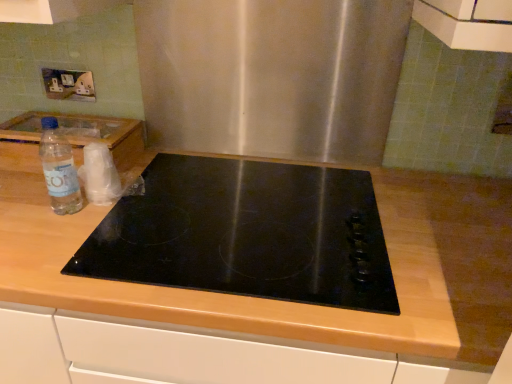
In order to click on black glass cooktop at center in this screenshot , I will do [x=247, y=233].

Locate an element on the screen. white plastic electric outlet at upper left is located at coordinates (68, 84).

Looking at this image, what is the approximate width of white plastic electric outlet at upper left?

It is 0.85 inches.

This screenshot has width=512, height=384. What do you see at coordinates (298, 303) in the screenshot?
I see `wooden at center` at bounding box center [298, 303].

What do you see at coordinates (59, 169) in the screenshot? I see `clear plastic bottle at left` at bounding box center [59, 169].

Where is `black glass cooktop at center`? This screenshot has width=512, height=384. black glass cooktop at center is located at coordinates (247, 233).

From a real-world perspective, is white plastic electric outlet at upper left physically above clear plastic bottle at left?

Yes, from a real-world perspective, white plastic electric outlet at upper left is over clear plastic bottle at left

Considering the relative sizes of white plastic electric outlet at upper left and clear plastic bottle at left in the image provided, is white plastic electric outlet at upper left bigger than clear plastic bottle at left?

No.

In terms of height, does white plastic electric outlet at upper left look taller or shorter compared to clear plastic bottle at left?

Considering their sizes, white plastic electric outlet at upper left has less height than clear plastic bottle at left.

Is white plastic electric outlet at upper left inside or outside of clear plastic bottle at left?

white plastic electric outlet at upper left is not enclosed by clear plastic bottle at left.

How different are the orientations of clear plastic bottle at left and black glass cooktop at center in degrees?

The facing directions of clear plastic bottle at left and black glass cooktop at center are 2.62 degrees apart.

Is clear plastic bottle at left spatially inside black glass cooktop at center, or outside of it?

clear plastic bottle at left is spatially situated outside black glass cooktop at center.

Which object is more forward, clear plastic bottle at left or black glass cooktop at center?

black glass cooktop at center is more forward.

Locate an element on the screen. This screenshot has width=512, height=384. bottle that is behind the black glass cooktop at center is located at coordinates (59, 169).

Is black glass cooktop at center at the right side of clear plastic bottle at left?

Indeed, black glass cooktop at center is positioned on the right side of clear plastic bottle at left.

From a real-world perspective, is black glass cooktop at center positioned above or below clear plastic bottle at left?

From a real-world perspective, black glass cooktop at center is physically below clear plastic bottle at left.

In terms of width, does black glass cooktop at center look wider or thinner when compared to clear plastic bottle at left?

Clearly, black glass cooktop at center has more width compared to clear plastic bottle at left.

Is clear plastic bottle at left to the left or to the right of wooden at center in the image?

In the image, clear plastic bottle at left appears on the left side of wooden at center.

Looking at this image, from the image's perspective, between clear plastic bottle at left and wooden at center, who is located below?

wooden at center, from the image's perspective.

What are the coordinates of `countertop on the right of clear plastic bottle at left` in the screenshot? It's located at (298, 303).

The image size is (512, 384). Identify the location of countertop below the white plastic electric outlet at upper left (from a real-world perspective). (298, 303).

How many degrees apart are the facing directions of wooden at center and white plastic electric outlet at upper left?

The angle between the facing direction of wooden at center and the facing direction of white plastic electric outlet at upper left is 1.05 degrees.

From the picture: Is wooden at center aimed at white plastic electric outlet at upper left?

No, wooden at center is not aimed at white plastic electric outlet at upper left.

From the image's perspective, is wooden at center positioned above or below white plastic electric outlet at upper left?

wooden at center is below white plastic electric outlet at upper left.

Consider the image. From their relative heights in the image, would you say wooden at center is taller or shorter than clear plastic bottle at left?

Considering their sizes, wooden at center has more height than clear plastic bottle at left.

Consider the image. From a real-world perspective, which is physically above, wooden at center or clear plastic bottle at left?

clear plastic bottle at left.

Is wooden at center outside of clear plastic bottle at left?

That's correct, wooden at center is outside of clear plastic bottle at left.

Is point (159, 293) positioned in front of point (74, 211)?

Yes, point (159, 293) is in front of point (74, 211).

Does white plastic electric outlet at upper left lie behind black glass cooktop at center?

Yes, white plastic electric outlet at upper left is further from the viewer.

How different are the orientations of white plastic electric outlet at upper left and black glass cooktop at center in degrees?

0.624 degrees.

Is point (66, 76) positioned behind point (218, 163)?

Yes.

From a real-world perspective, which object rests below the other?

In real-world perspective, black glass cooktop at center is lower.

Identify the location of electric outlet lying behind the clear plastic bottle at left. The image size is (512, 384). (68, 84).

This screenshot has height=384, width=512. I want to click on gas stove in front of the clear plastic bottle at left, so click(x=247, y=233).

Estimate the real-world distances between objects in this image. Which object is closer to wooden at center, clear plastic bottle at left or white plastic electric outlet at upper left?

clear plastic bottle at left.

When comparing their distances from black glass cooktop at center, does clear plastic bottle at left or wooden at center seem further?

clear plastic bottle at left.

Based on their spatial positions, is wooden at center or clear plastic bottle at left closer to black glass cooktop at center?

wooden at center.

Considering their positions, is white plastic electric outlet at upper left positioned further to clear plastic bottle at left than wooden at center?

The object further to clear plastic bottle at left is wooden at center.

Considering their positions, is black glass cooktop at center positioned closer to wooden at center than clear plastic bottle at left?

black glass cooktop at center is closer to wooden at center.

Which object lies further to the anchor point wooden at center, clear plastic bottle at left or black glass cooktop at center?

clear plastic bottle at left.

Which object lies further to the anchor point clear plastic bottle at left, black glass cooktop at center or wooden at center?

wooden at center lies further to clear plastic bottle at left than the other object.

Based on their spatial positions, is black glass cooktop at center or white plastic electric outlet at upper left closer to clear plastic bottle at left?

The object closer to clear plastic bottle at left is white plastic electric outlet at upper left.

Locate an element on the screen. The width and height of the screenshot is (512, 384). gas stove between clear plastic bottle at left and wooden at center from top to bottom is located at coordinates (247, 233).

Locate an element on the screen. bottle that lies between white plastic electric outlet at upper left and wooden at center from top to bottom is located at coordinates (59, 169).

The height and width of the screenshot is (384, 512). I want to click on gas stove between white plastic electric outlet at upper left and wooden at center vertically, so tap(247, 233).

This screenshot has width=512, height=384. Find the location of `bottle between white plastic electric outlet at upper left and black glass cooktop at center from left to right`. bottle between white plastic electric outlet at upper left and black glass cooktop at center from left to right is located at coordinates coord(59,169).